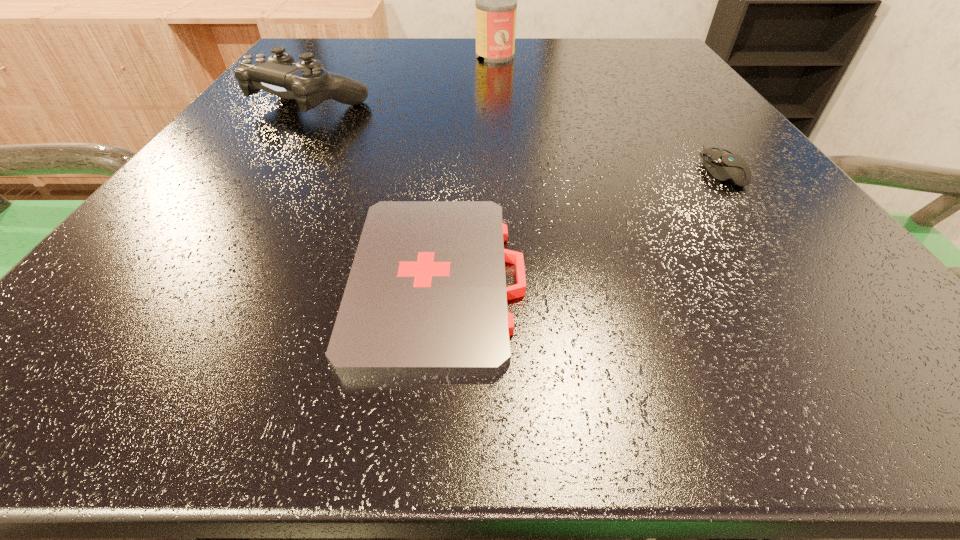
Select which object appears as the second closest to the nearest object. Please provide its 2D coordinates. Your answer should be formatted as a tuple, i.e. [(x, y)], where the tuple contains the x and y coordinates of a point satisfying the conditions above.

[(724, 165)]

Locate an element on the screen. Image resolution: width=960 pixels, height=540 pixels. object that is the second closest to the control is located at coordinates (426, 295).

Find the location of a particular element. free space that satisfies the following two spatial constraints: 1. on the back side of the can; 2. on the left side of the third shortest object is located at coordinates (340, 56).